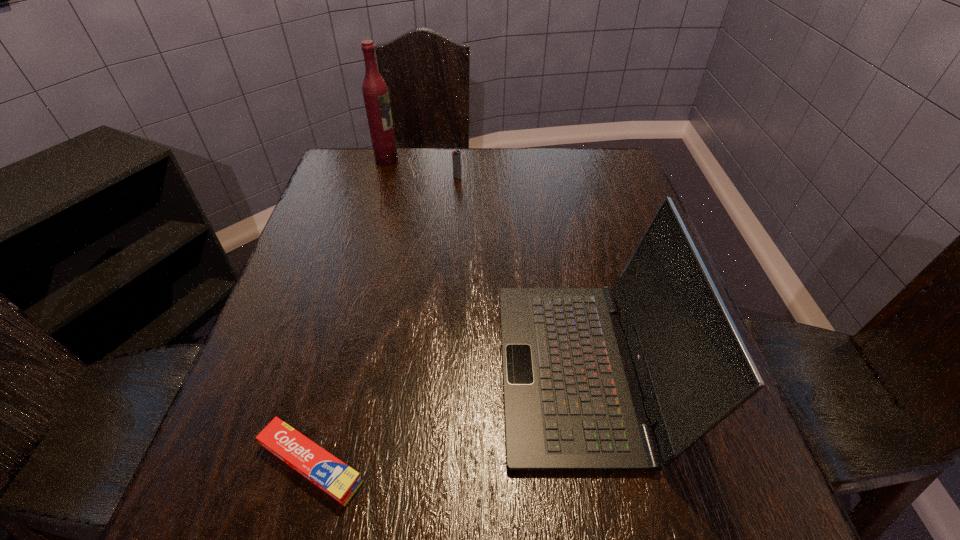
I want to click on the farthest object, so click(x=375, y=92).

Identify the location of liquor. Image resolution: width=960 pixels, height=540 pixels. (375, 92).

I want to click on laptop computer, so click(572, 402).

The height and width of the screenshot is (540, 960). Find the location of `the rightmost object`. the rightmost object is located at coordinates (572, 402).

This screenshot has height=540, width=960. I want to click on the third nearest object, so click(x=456, y=158).

Locate an element on the screen. This screenshot has width=960, height=540. igniter is located at coordinates (456, 158).

Identify the location of the shortest object. This screenshot has width=960, height=540. (337, 479).

What are the coordinates of `vacant region located on the label of the farthest object` in the screenshot? It's located at (425, 160).

Locate an element on the screen. The image size is (960, 540). free space located 0.380m on the screen of the laptop computer is located at coordinates (295, 369).

Locate an element on the screen. This screenshot has height=540, width=960. vacant space located on the screen of the laptop computer is located at coordinates (371, 369).